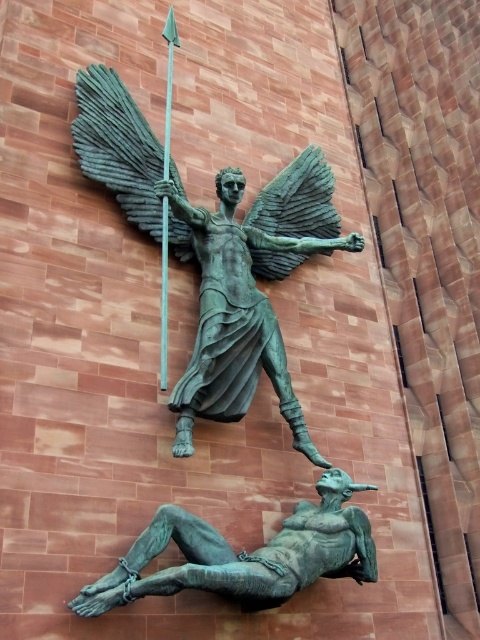
You are an art conservator examining the bronze sculpture. You notice two points of concern marked on the sculpture. The first point is at coordinate point (124, 196) and the second is at point (359, 580). Which point is closer to the viewer?

Point (359, 580) is closer to the viewer because point (124, 196) is behind it.

Based on the photo, you are an art conservator assessing the spatial relationship between the bronze statue at upper center and the green metallic spear at center. Which object is shorter in height?

The bronze statue at upper center has a lesser height compared to the green metallic spear at center, so the bronze statue at upper center is shorter in height.